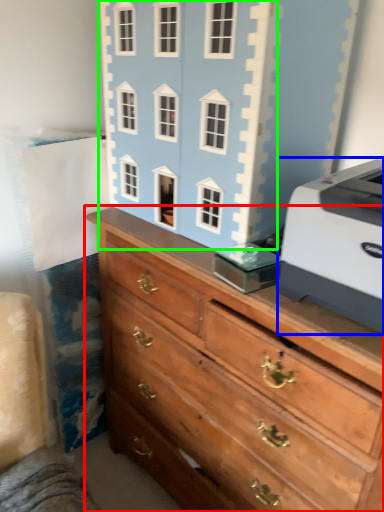
Question: Which object is positioned closest to chest of drawers (highlighted by a red box)? Select from printer (highlighted by a blue box) and toy (highlighted by a green box).

Choices:
 (A) printer
 (B) toy

Answer: (A)